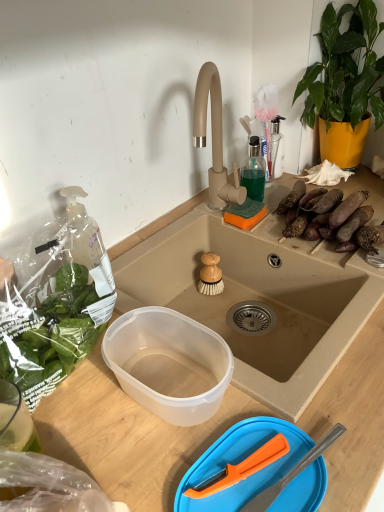
At what (x,y) coordinates should I click in order to perform the action: click on transparent plastic container at center. Please return your answer as a coordinate pair (x, y). The image size is (384, 512). Looking at the image, I should click on (242, 287).

Find the location of `brown rough sweet potatoes at right`. brown rough sweet potatoes at right is located at coordinates (333, 220).

At what (x,y) coordinates should I click in order to perform the action: click on wooden-bristled brush at sink center. Please return your answer as a coordinate pair (x, y). This screenshot has width=384, height=512. Looking at the image, I should click on (210, 275).

Which is more distant, (x=346, y=236) or (x=193, y=362)?

The point (x=346, y=236) is behind.

Is brown rough sweet potatoes at right wider than transparent plastic bowl at lower center?

Yes, brown rough sweet potatoes at right is wider than transparent plastic bowl at lower center.

From a real-world perspective, is brown rough sweet potatoes at right positioned over transparent plastic bowl at lower center based on gravity?

Indeed, from a real-world perspective, brown rough sweet potatoes at right stands above transparent plastic bowl at lower center.

This screenshot has height=512, width=384. Find the location of `bowl in front of the brown rough sweet potatoes at right`. bowl in front of the brown rough sweet potatoes at right is located at coordinates (170, 360).

Can you confirm if transparent plastic bowl at lower center is thinner than green leafy plant at upper right?

Indeed, transparent plastic bowl at lower center has a lesser width compared to green leafy plant at upper right.

From the image's perspective, is transparent plastic bowl at lower center below green leafy plant at upper right?

Yes, from the image's perspective, transparent plastic bowl at lower center is beneath green leafy plant at upper right.

Considering the positions of objects transparent plastic bowl at lower center and green leafy plant at upper right in the image provided, who is more to the right, transparent plastic bowl at lower center or green leafy plant at upper right?

green leafy plant at upper right.

This screenshot has height=512, width=384. I want to click on bowl on the left of green leafy plant at upper right, so [170, 360].

Could transparent plastic bowl at lower center be considered to be inside transparent plastic container at center?

No.

From the picture: Considering the sizes of objects transparent plastic container at center and transparent plastic bowl at lower center in the image provided, who is shorter, transparent plastic container at center or transparent plastic bowl at lower center?

transparent plastic bowl at lower center.

Considering the positions of points (149, 419) and (128, 379), is point (149, 419) closer to camera compared to point (128, 379)?

That is True.

Does transparent plastic container at center appear on the right side of transparent plastic bowl at lower center?

Yes.

You are a GUI agent. You are given a task and a screenshot of the screen. Output one action in this format:
    pyautogui.click(x=<x>, y=<y>)
    Task: Click on the desk below the wooden-bristled brush at sink center (from the image's perspective)
    This screenshot has width=384, height=512.
    Given the screenshot: What is the action you would take?
    pyautogui.click(x=242, y=287)

Who is shorter, transparent plastic container at center or wooden-bristled brush at sink center?

With less height is wooden-bristled brush at sink center.

Based on the photo, which is more to the right, transparent plastic container at center or wooden-bristled brush at sink center?

transparent plastic container at center.

Is transparent plastic container at center looking in the opposite direction of wooden-bristled brush at sink center?

Yes, transparent plastic container at center's orientation is away from wooden-bristled brush at sink center.

How many degrees apart are the facing directions of transparent plastic container at center and translucent glass bottle at upper center?

0.0475 degrees separate the facing orientations of transparent plastic container at center and translucent glass bottle at upper center.

Is the depth of transparent plastic container at center less than that of translucent glass bottle at upper center?

Yes.

Is point (246, 260) positioned behind point (257, 145)?

No, it is not.

Which object is positioned more to the right, brown rough sweet potatoes at right or wooden-bristled brush at sink center?

brown rough sweet potatoes at right.

Considering the sizes of objects brown rough sweet potatoes at right and wooden-bristled brush at sink center in the image provided, who is taller, brown rough sweet potatoes at right or wooden-bristled brush at sink center?

Standing taller between the two is wooden-bristled brush at sink center.

At what (x,y) coordinates should I click in order to perform the action: click on brush below the brown rough sweet potatoes at right (from the image's perspective). Please return your answer as a coordinate pair (x, y). The height and width of the screenshot is (512, 384). Looking at the image, I should click on (210, 275).

Is translucent glass bottle at upper center not close to transparent plastic bowl at lower center?

They are positioned close to each other.

Between translucent glass bottle at upper center and transparent plastic bowl at lower center, which one has more height?

Standing taller between the two is translucent glass bottle at upper center.

Is translucent glass bottle at upper center spatially inside transparent plastic bowl at lower center, or outside of it?

The correct answer is: outside.

Identify the location of bowl below the brown rough sweet potatoes at right (from the image's perspective). This screenshot has width=384, height=512. (170, 360).

Find the location of a particular element. houseplant behind the transparent plastic bowl at lower center is located at coordinates (345, 83).

Which object lies further to the anchor point green leafy plant at upper right, transparent plastic container at center or brown rough sweet potatoes at right?

transparent plastic container at center is further to green leafy plant at upper right.

From the image, which object appears to be nearer to wooden-bristled brush at sink center, transparent plastic bowl at lower center or transparent plastic container at center?

transparent plastic container at center is positioned closer to the anchor wooden-bristled brush at sink center.

From the image, which object appears to be nearer to transparent plastic container at center, wooden-bristled brush at sink center or translucent glass bottle at upper center?

Based on the image, wooden-bristled brush at sink center appears to be nearer to transparent plastic container at center.

Estimate the real-world distances between objects in this image. Which object is further from translucent glass bottle at upper center, wooden-bristled brush at sink center or transparent plastic container at center?

The object further to translucent glass bottle at upper center is transparent plastic container at center.

Looking at the image, which one is located closer to transparent plastic container at center, brown rough sweet potatoes at right or wooden-bristled brush at sink center?

brown rough sweet potatoes at right is closer to transparent plastic container at center.

Which object lies further to the anchor point transparent plastic container at center, translucent glass bottle at upper center or wooden-bristled brush at sink center?

The object further to transparent plastic container at center is translucent glass bottle at upper center.

Considering their positions, is wooden-bristled brush at sink center positioned closer to transparent plastic bowl at lower center than transparent plastic container at center?

transparent plastic container at center.

Which object lies further to the anchor point green leafy plant at upper right, wooden-bristled brush at sink center or transparent plastic bowl at lower center?

Based on the image, transparent plastic bowl at lower center appears to be further to green leafy plant at upper right.

Where is `desk between transparent plastic bowl at lower center and wooden-bristled brush at sink center along the z-axis`? The width and height of the screenshot is (384, 512). desk between transparent plastic bowl at lower center and wooden-bristled brush at sink center along the z-axis is located at coordinates (242, 287).

The image size is (384, 512). In order to click on bottle between wooden-bristled brush at sink center and brown rough sweet potatoes at right in the horizontal direction in this screenshot , I will do `click(253, 170)`.

Locate an element on the screen. food between green leafy plant at upper right and transparent plastic bowl at lower center vertically is located at coordinates (333, 220).

The width and height of the screenshot is (384, 512). What are the coordinates of `bottle that lies between green leafy plant at upper right and transparent plastic bowl at lower center from top to bottom` in the screenshot? It's located at (253, 170).